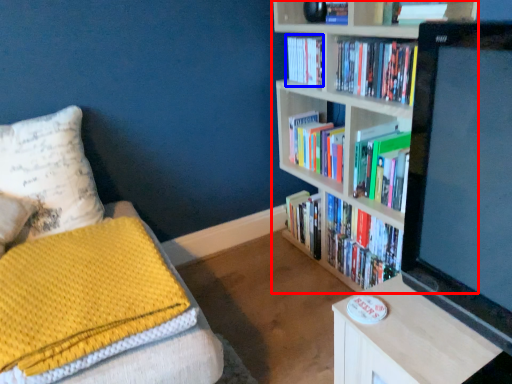
Question: Which point is further to the camera, bookcase (highlighted by a red box) or book (highlighted by a blue box)?

Choices:
 (A) bookcase
 (B) book

Answer: (B)